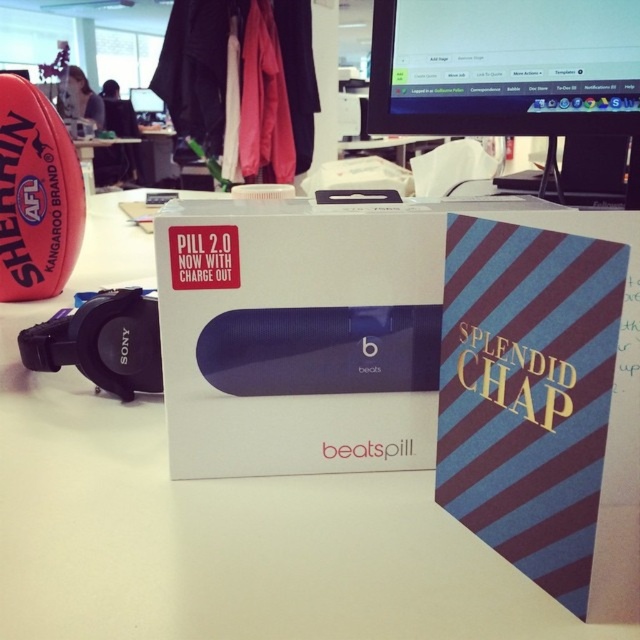
Question: Is white matte table at center below white matte box at center?

Choices:
 (A) no
 (B) yes

Answer: (B)

Question: Which of the following is the farthest from the observer?

Choices:
 (A) black glossy computer monitor at upper center
 (B) white matte box at center

Answer: (A)

Question: Among these points, which one is nearest to the camera?

Choices:
 (A) (250, 380)
 (B) (54, 538)
 (C) (636, 58)

Answer: (B)

Question: Which of the following is the farthest from the observer?

Choices:
 (A) (403, 225)
 (B) (436, 93)
 (C) (138, 157)

Answer: (C)

Question: Is white matte table at center smaller than white matte box at center?

Choices:
 (A) yes
 (B) no

Answer: (B)

Question: Is white matte box at center smaller than black glossy computer monitor at upper center?

Choices:
 (A) yes
 (B) no

Answer: (B)